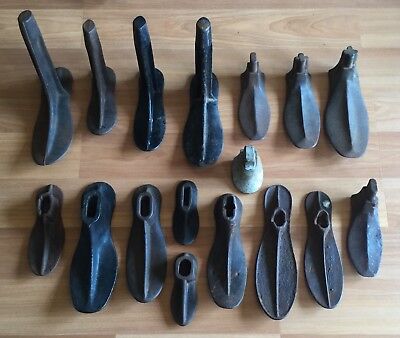
Find the location of a particular element. The image size is (400, 338). medium wood board of floor is located at coordinates (113, 160).